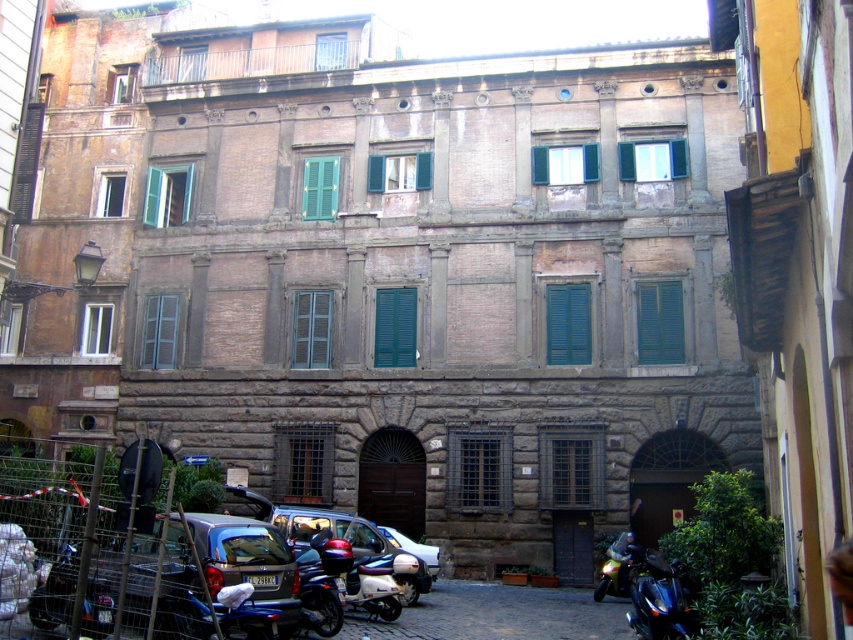
Who is more distant from viewer, (300, 541) or (328, 534)?

Point (300, 541)

Is point (241, 499) more distant than point (318, 548)?

That is True.

At what (x,y) coordinates should I click in order to perform the action: click on matte blue car at center. Please return your answer as a coordinate pair (x, y). Looking at the image, I should click on (334, 534).

Does metallic silver scooter at lower center have a larger size compared to shiny blue motorcycle at lower right?

Actually, metallic silver scooter at lower center might be smaller than shiny blue motorcycle at lower right.

Between metallic silver scooter at lower center and shiny blue motorcycle at lower right, which one is positioned higher?

metallic silver scooter at lower center is above.

Measure the distance between point (338, 554) and camera.

Point (338, 554) and camera are 33.25 meters apart.

In order to click on metallic silver scooter at lower center in this screenshot , I will do `click(358, 577)`.

Is point (305, 506) in front of point (387, 620)?

No, it is not.

Is matte blue car at center to the left of metallic silver scooter at lower center from the viewer's perspective?

Indeed, matte blue car at center is positioned on the left side of metallic silver scooter at lower center.

Identify the location of matte blue car at center. This screenshot has height=640, width=853. pyautogui.click(x=334, y=534).